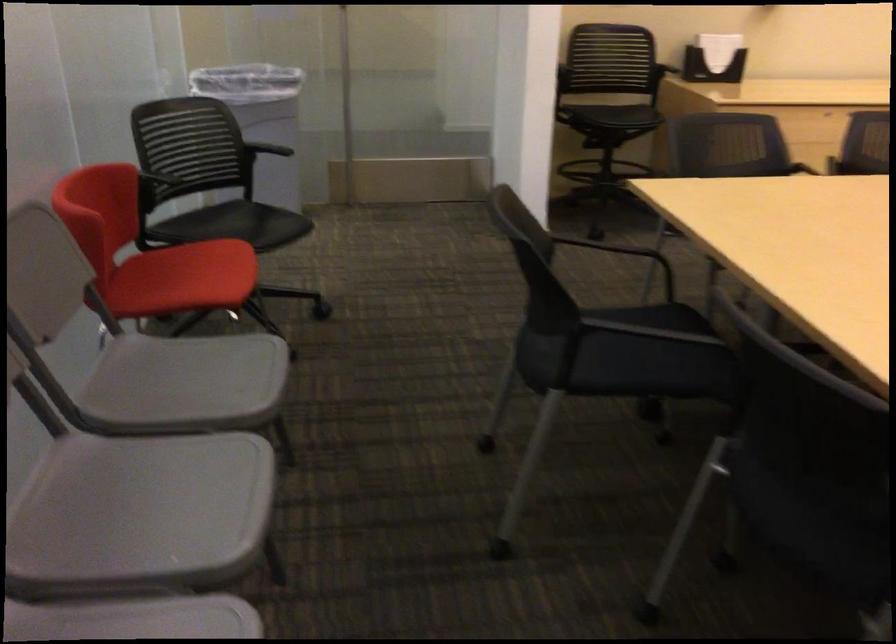
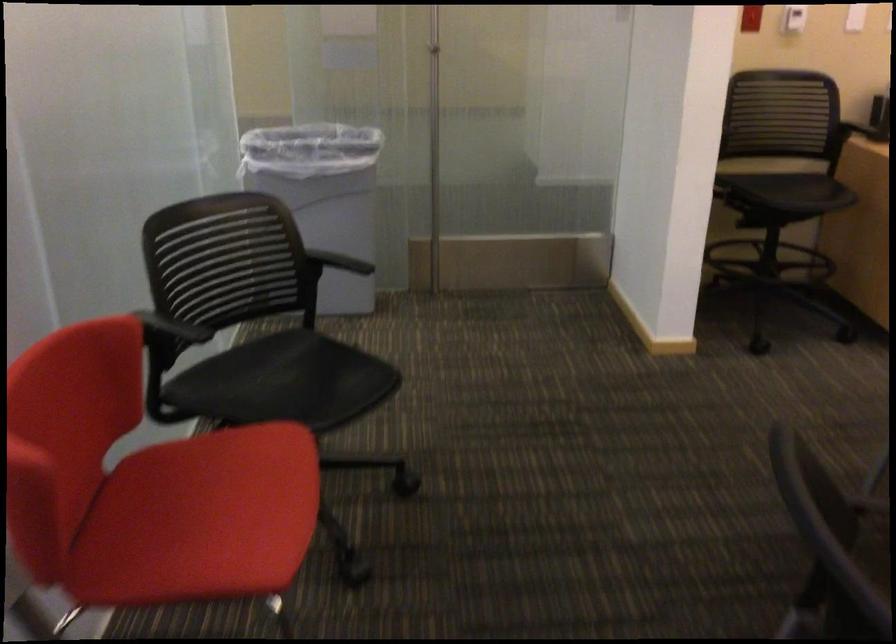
Question: Which direction would the cameraman need to move to produce the second image? Reply with the corresponding letter.

Choices:
 (A) Left
 (B) Right
 (C) Forward
 (D) Backward

Answer: (C)